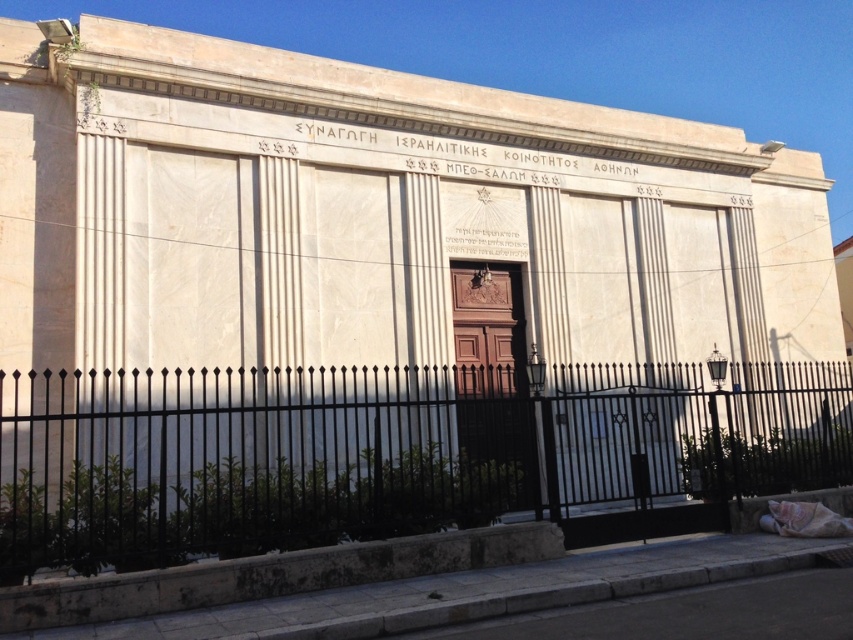
Who is positioned more to the right, black wrought iron fence at lower center or gray concrete curb at lower center?

From the viewer's perspective, black wrought iron fence at lower center appears more on the right side.

Can you confirm if black wrought iron fence at lower center is smaller than gray concrete curb at lower center?

No, black wrought iron fence at lower center is not smaller than gray concrete curb at lower center.

Is point (4, 433) positioned before point (352, 582)?

No, (4, 433) is behind (352, 582).

At what (x,y) coordinates should I click in order to perform the action: click on black wrought iron fence at lower center. Please return your answer as a coordinate pair (x, y). The width and height of the screenshot is (853, 640). Looking at the image, I should click on click(x=387, y=452).